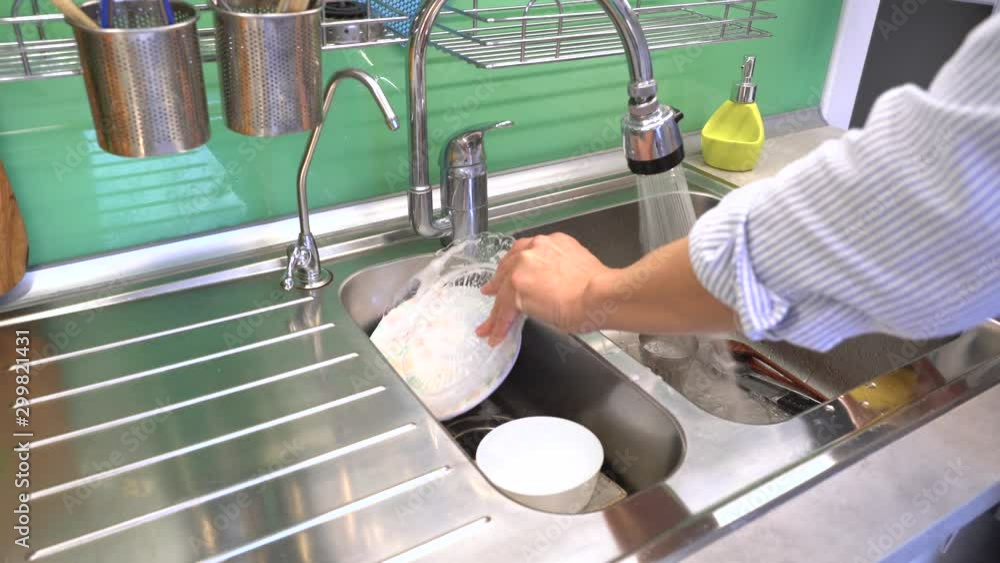
Where is `rack`? rack is located at coordinates (547, 32).